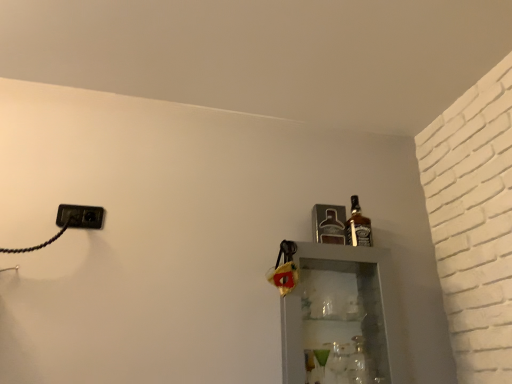
Question: Does black plastic outlet at left come behind clear glass bottle at right, marked as the third bottle in a top-to-bottom arrangement?

Choices:
 (A) no
 (B) yes

Answer: (B)

Question: Considering the relative sizes of black plastic outlet at left and clear glass bottle at right, the first bottle in the bottom-to-top sequence, in the image provided, is black plastic outlet at left smaller than clear glass bottle at right, the first bottle in the bottom-to-top sequence,?

Choices:
 (A) yes
 (B) no

Answer: (A)

Question: From the image's perspective, is black plastic outlet at left located above clear glass bottle at right, the first bottle in the bottom-to-top sequence?

Choices:
 (A) no
 (B) yes

Answer: (B)

Question: Can you confirm if black plastic outlet at left is taller than clear glass bottle at right, marked as the third bottle in a top-to-bottom arrangement?

Choices:
 (A) yes
 (B) no

Answer: (B)

Question: Considering the relative sizes of black plastic outlet at left and clear glass bottle at right, marked as the third bottle in a top-to-bottom arrangement, in the image provided, is black plastic outlet at left thinner than clear glass bottle at right, marked as the third bottle in a top-to-bottom arrangement,?

Choices:
 (A) no
 (B) yes

Answer: (B)

Question: From a real-world perspective, is black plastic outlet at left located beneath clear glass bottle at right, marked as the third bottle in a top-to-bottom arrangement?

Choices:
 (A) yes
 (B) no

Answer: (B)

Question: From a real-world perspective, is brown glass bottle at upper right, marked as the third bottle in a bottom-to-top arrangement, positioned under metallic silver bottle at upper right, the 2th bottle when ordered from bottom to top, based on gravity?

Choices:
 (A) yes
 (B) no

Answer: (B)

Question: Is brown glass bottle at upper right, marked as the 1th bottle in a top-to-bottom arrangement, thinner than metallic silver bottle at upper right, the 2th bottle when ordered from bottom to top?

Choices:
 (A) no
 (B) yes

Answer: (B)

Question: Does brown glass bottle at upper right, marked as the 1th bottle in a top-to-bottom arrangement, have a greater height compared to metallic silver bottle at upper right, the 2th bottle when ordered from bottom to top?

Choices:
 (A) yes
 (B) no

Answer: (A)

Question: From the image's perspective, is brown glass bottle at upper right, marked as the third bottle in a bottom-to-top arrangement, below metallic silver bottle at upper right, arranged as the 2th bottle when viewed from the top?

Choices:
 (A) yes
 (B) no

Answer: (B)

Question: Considering the relative positions of brown glass bottle at upper right, marked as the 1th bottle in a top-to-bottom arrangement, and metallic silver bottle at upper right, arranged as the 2th bottle when viewed from the top, in the image provided, is brown glass bottle at upper right, marked as the 1th bottle in a top-to-bottom arrangement, behind metallic silver bottle at upper right, arranged as the 2th bottle when viewed from the top,?

Choices:
 (A) no
 (B) yes

Answer: (A)

Question: Is brown glass bottle at upper right, marked as the 1th bottle in a top-to-bottom arrangement, at the right side of metallic silver bottle at upper right, arranged as the 2th bottle when viewed from the top?

Choices:
 (A) no
 (B) yes

Answer: (B)

Question: From the image's perspective, is brown glass bottle at upper right, marked as the third bottle in a bottom-to-top arrangement, above black plastic outlet at left?

Choices:
 (A) yes
 (B) no

Answer: (B)